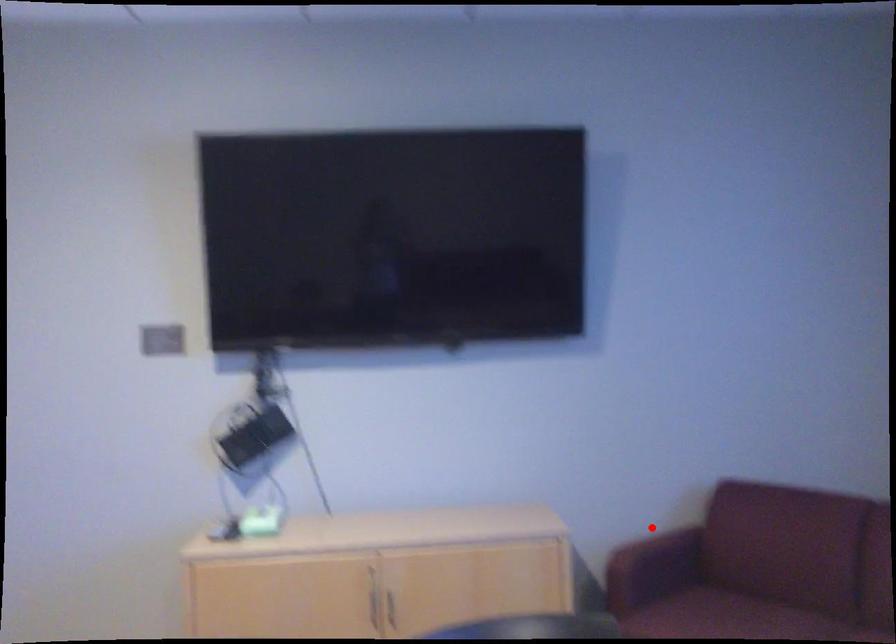
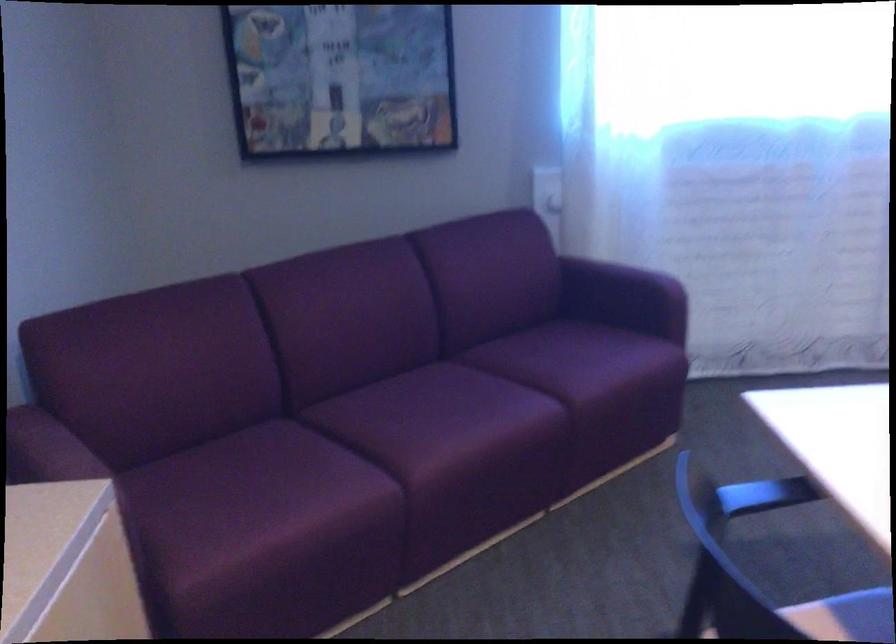
Question: I am providing you with two images of the same scene from different viewpoints. A red point is shown in image1. For the corresponding object point in image2, is it positioned nearer or farther from the camera?

Choices:
 (A) Nearer
 (B) Farther

Answer: (A)